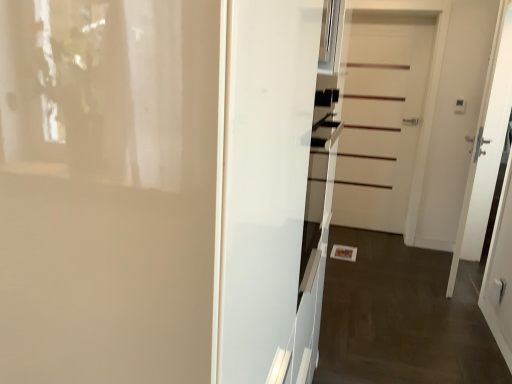
Question: Is white glossy oven at center to the left or to the right of white matte door at center, the 2th door viewed from the left, in the image?

Choices:
 (A) right
 (B) left

Answer: (B)

Question: Considering the positions of white glossy oven at center and white matte door at center, marked as the second door in a right-to-left arrangement, in the image, is white glossy oven at center wider or thinner than white matte door at center, marked as the second door in a right-to-left arrangement,?

Choices:
 (A) wide
 (B) thin

Answer: (B)

Question: Which object is positioned closest to the white matte door at center, which appears as the first door when viewed from the right?

Choices:
 (A) white glossy door at center, the third door in the back-to-front sequence
 (B) white matte door at center, marked as the 1th door in a back-to-front arrangement
 (C) white glossy oven at center

Answer: (B)

Question: Which is farther from the white glossy door at center, which ranks as the 1th door in front-to-back order?

Choices:
 (A) white glossy oven at center
 (B) white matte door at center, positioned as the 2th door in back-to-front order
 (C) white matte door at center, marked as the 1th door in a back-to-front arrangement

Answer: (C)